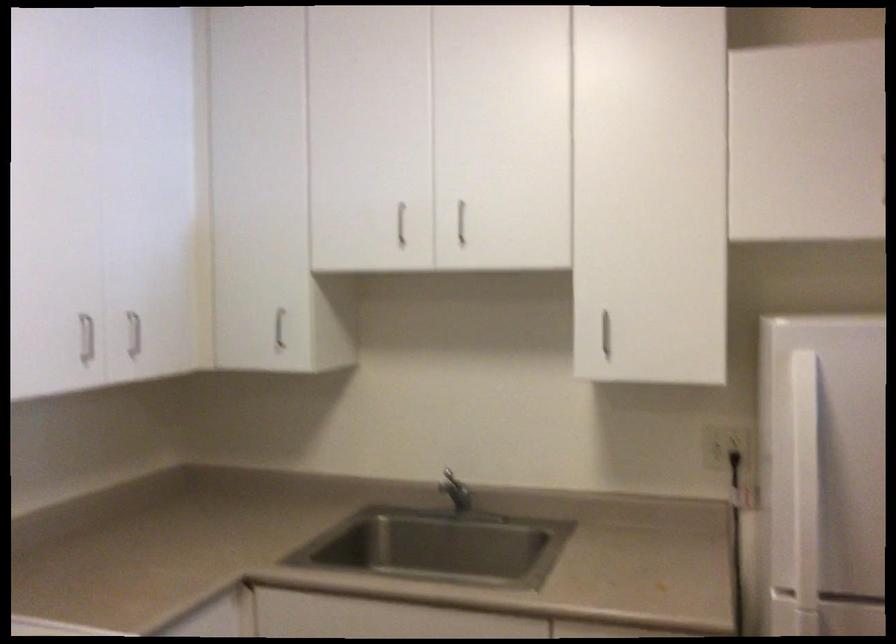
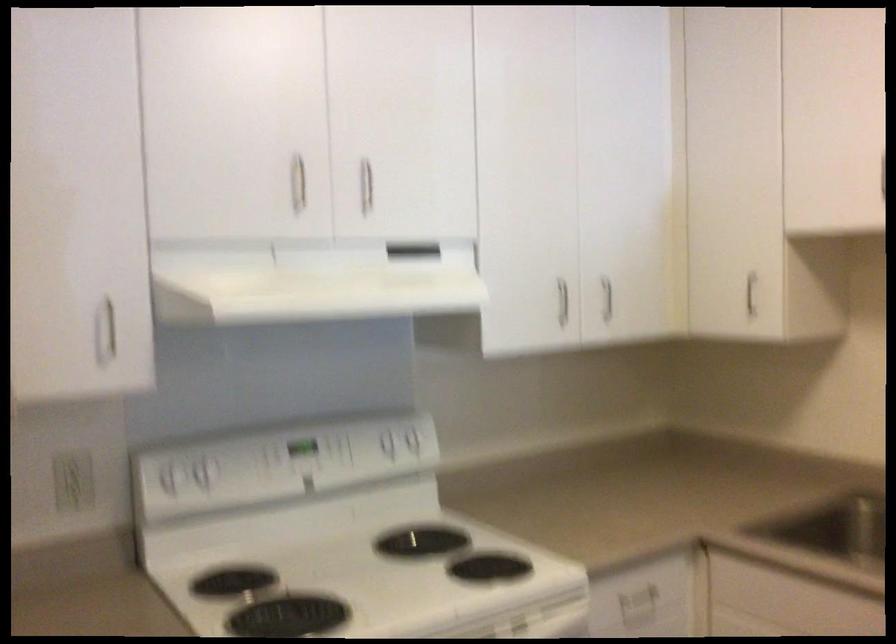
Question: The camera is either moving clockwise (left) or counter-clockwise (right) around the object. The first image is from the beginning of the video and the second image is from the end. Is the camera moving left or right when shooting the video?

Choices:
 (A) Left
 (B) Right

Answer: (B)